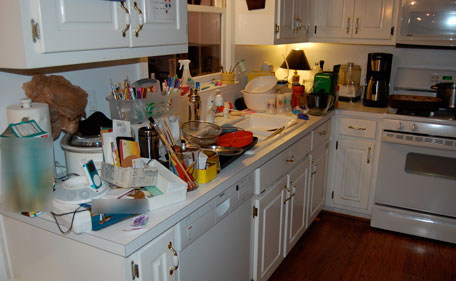
The height and width of the screenshot is (281, 456). In order to click on coffee pot in this screenshot , I will do `click(380, 75)`.